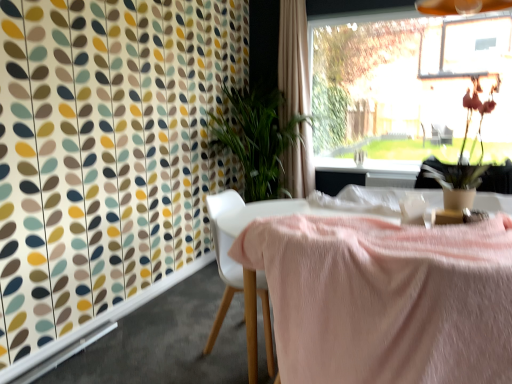
Question: Looking at the image, does white plastic chair at center seem bigger or smaller compared to matte brown vase with dried flowers at upper right?

Choices:
 (A) small
 (B) big

Answer: (B)

Question: From a real-world perspective, relative to matte brown vase with dried flowers at upper right, is white plastic chair at center vertically above or below?

Choices:
 (A) above
 (B) below

Answer: (B)

Question: Based on their relative distances, which object is farther from the white plastic chair at center?

Choices:
 (A) beige fabric curtain at upper center
 (B) pink fabric-covered table at center
 (C) transparent glass window at upper right
 (D) matte brown vase with dried flowers at upper right

Answer: (C)

Question: Estimate the real-world distances between objects in this image. Which object is closer to the beige fabric curtain at upper center?

Choices:
 (A) pink fabric-covered table at center
 (B) matte brown vase with dried flowers at upper right
 (C) transparent glass window at upper right
 (D) white plastic chair at center

Answer: (B)